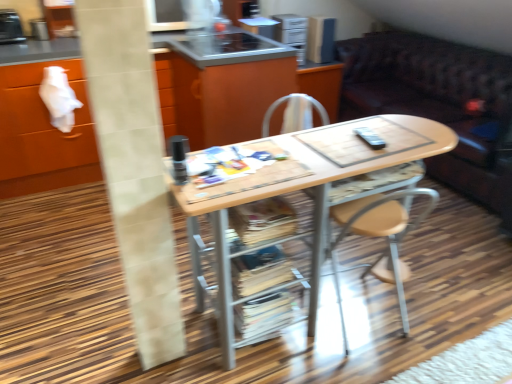
At what (x,y) coordinates should I click in order to perform the action: click on vacant area located to the right-hand side of white tile pillar at left. Please return your answer as a coordinate pair (x, y). The image size is (512, 384). Looking at the image, I should click on point(211,360).